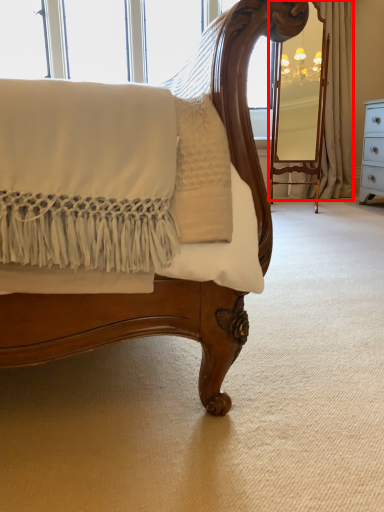
Question: Where is curtain (annotated by the red box) located in relation to curtain in the image?

Choices:
 (A) left
 (B) right

Answer: (A)